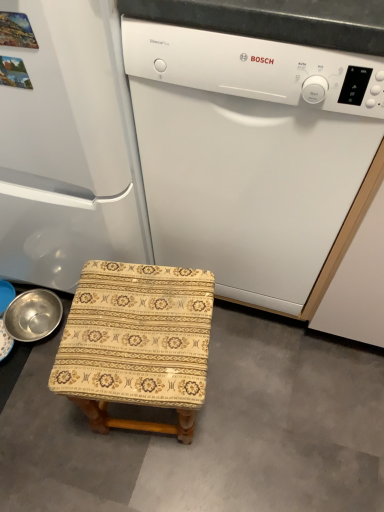
Question: Is point (46, 13) positioned closer to the camera than point (223, 251)?

Choices:
 (A) closer
 (B) farther

Answer: (A)

Question: From a real-world perspective, is white matte refrigerator at left above or below white matte dishwasher at center?

Choices:
 (A) above
 (B) below

Answer: (A)

Question: Estimate the real-world distances between objects in this image. Which object is closer to the patterned fabric stool at center?

Choices:
 (A) beige fabric stool at lower left
 (B) white matte dishwasher at center
 (C) metallic silver basin at lower left
 (D) white matte refrigerator at left

Answer: (D)

Question: Based on their relative distances, which object is nearer to the white matte refrigerator at left?

Choices:
 (A) metallic silver basin at lower left
 (B) white matte dishwasher at center
 (C) beige fabric stool at lower left
 (D) patterned fabric stool at center

Answer: (B)